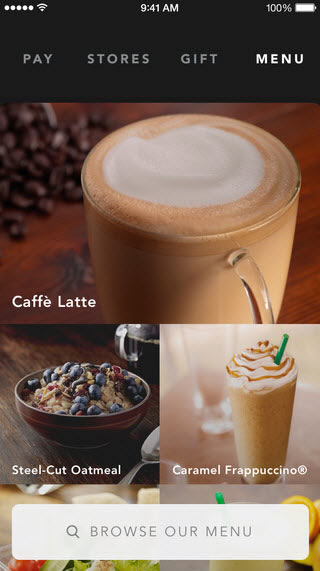
Where is `empty clear glass`? empty clear glass is located at coordinates pos(214,373).